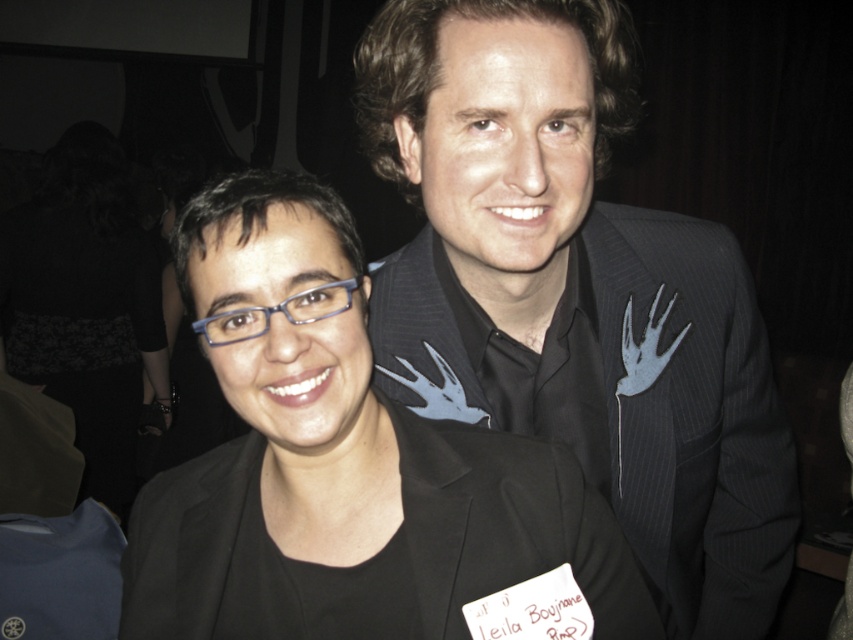
Between point (720, 276) and point (136, 611), which one is positioned behind?

Positioned behind is point (720, 276).

Identify the location of dark pinstripe suit at center. This screenshot has width=853, height=640. 575,292.